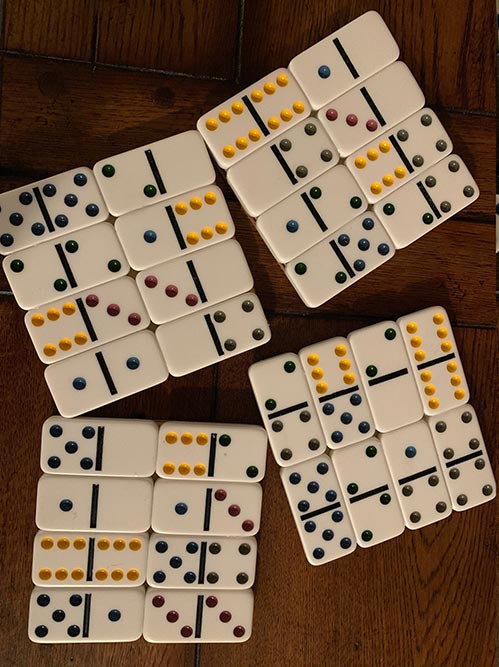
Locate an element on the screen. The width and height of the screenshot is (499, 667). table is located at coordinates (303, 325).